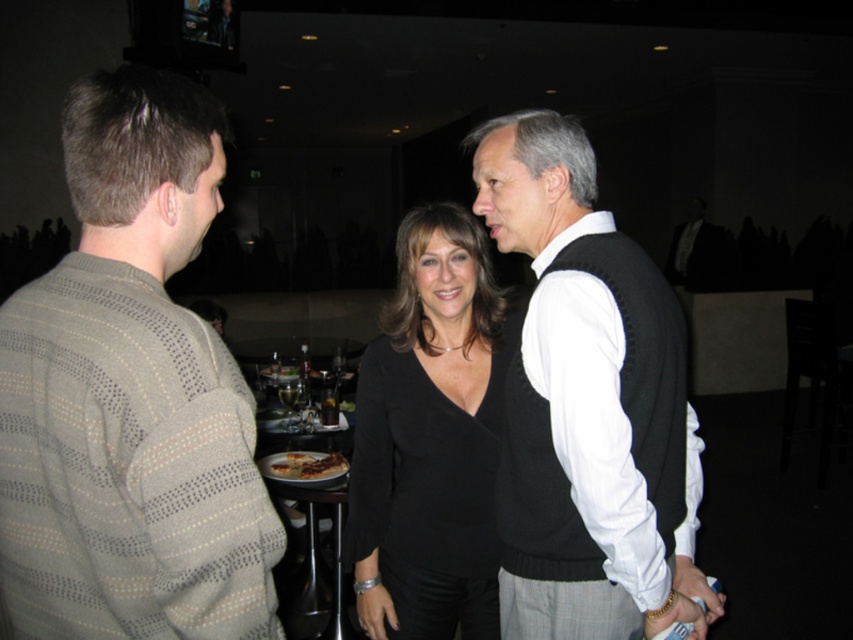
Which is more to the left, black knit vest at center or wooden table at center?

wooden table at center

Who is more forward, (x=720, y=605) or (x=332, y=506)?

Point (x=720, y=605)

Does point (648, 550) come closer to viewer compared to point (331, 602)?

Yes, point (648, 550) is closer to viewer.

This screenshot has height=640, width=853. What are the coordinates of `black knit vest at center` in the screenshot? It's located at (585, 406).

Who is more distant from viewer, (74, 282) or (364, 499)?

Point (364, 499)

Does striped knit sweater at left appear on the left side of black matte top at center?

Correct, you'll find striped knit sweater at left to the left of black matte top at center.

Where is `striped knit sweater at left`? striped knit sweater at left is located at coordinates (131, 396).

At what (x,y) coordinates should I click in order to perform the action: click on striped knit sweater at left. Please return your answer as a coordinate pair (x, y). Looking at the image, I should click on (131, 396).

Does black matte top at center have a lesser width compared to wooden table at center?

No.

Based on the photo, how far apart are black matte top at center and wooden table at center?

They are 18.90 inches apart.

The width and height of the screenshot is (853, 640). In order to click on black matte top at center in this screenshot , I will do `click(430, 438)`.